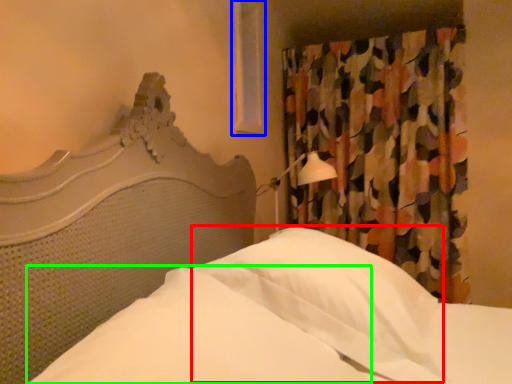
Question: Based on their relative distances, which object is nearer to pillow (highlighted by a red box)? Choose from window (highlighted by a blue box) and sheet (highlighted by a green box).

Choices:
 (A) window
 (B) sheet

Answer: (B)